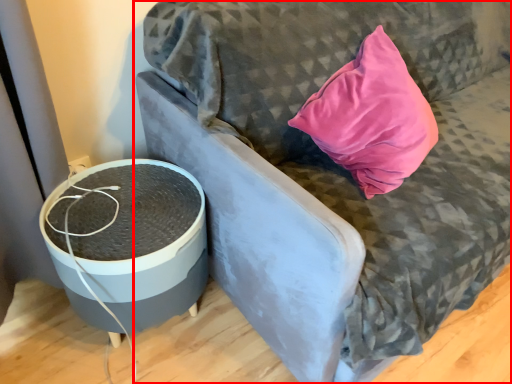
Question: From the image's perspective, where is furniture (annotated by the red box) located in relation to round table in the image?

Choices:
 (A) below
 (B) above

Answer: (B)